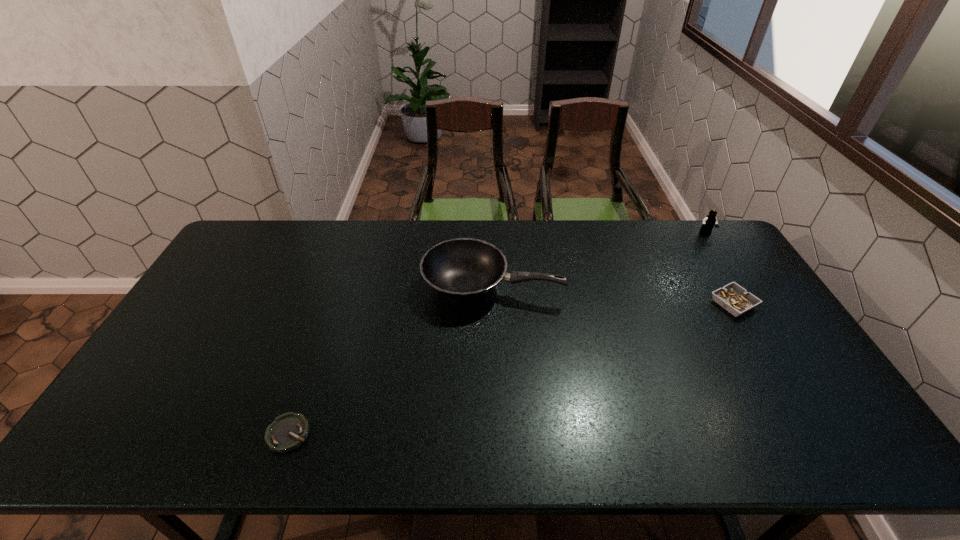
Identify the location of vacant region at the far left corner of the desktop. (249, 241).

At what (x,y) coordinates should I click in order to perform the action: click on vacant area that lies between the leftmost object and the Lego. Please return your answer as a coordinate pair (x, y). Image resolution: width=960 pixels, height=540 pixels. Looking at the image, I should click on (497, 333).

Locate an element on the screen. The width and height of the screenshot is (960, 540). vacant area that lies between the third object from right to left and the farthest object is located at coordinates (599, 260).

Identify the location of free space between the leftmost object and the Lego. The height and width of the screenshot is (540, 960). (497, 333).

Identify the location of empty space that is in between the second object from left to right and the nearer ashtray. The image size is (960, 540). (391, 360).

You are a GUI agent. You are given a task and a screenshot of the screen. Output one action in this format:
    pyautogui.click(x=<x>, y=<y>)
    Task: Click on the vacant area that lies between the frying pan and the farthest object
    
    Given the screenshot: What is the action you would take?
    pyautogui.click(x=599, y=260)

Where is `free space between the nearer ashtray and the farther ashtray`? This screenshot has height=540, width=960. free space between the nearer ashtray and the farther ashtray is located at coordinates click(511, 369).

I want to click on free space between the second object from left to right and the leftmost object, so click(391, 360).

At what (x,y) coordinates should I click in order to perform the action: click on free point between the frying pan and the shortest object. Please return your answer as a coordinate pair (x, y). The height and width of the screenshot is (540, 960). Looking at the image, I should click on (391, 360).

Locate an element on the screen. This screenshot has width=960, height=540. vacant area that lies between the Lego and the right ashtray is located at coordinates (720, 268).